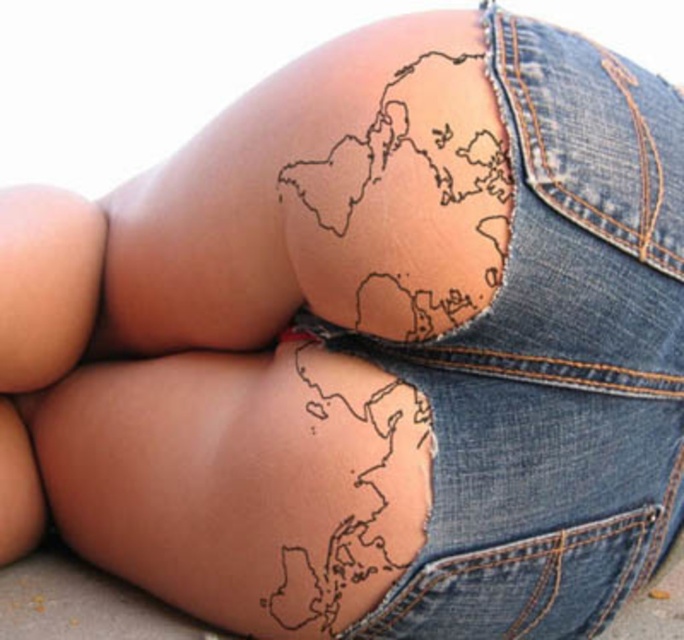
Between point (607, 115) and point (378, 588), which one is positioned in front?

Point (607, 115) is more forward.

Which of these two, denim at center or black ink map at lower center, stands shorter?

Standing shorter between the two is black ink map at lower center.

Locate an element on the screen. The image size is (684, 640). denim at center is located at coordinates (555, 362).

At what (x,y) coordinates should I click in order to perform the action: click on denim at center. Please return your answer as a coordinate pair (x, y). This screenshot has height=640, width=684. Looking at the image, I should click on (555, 362).